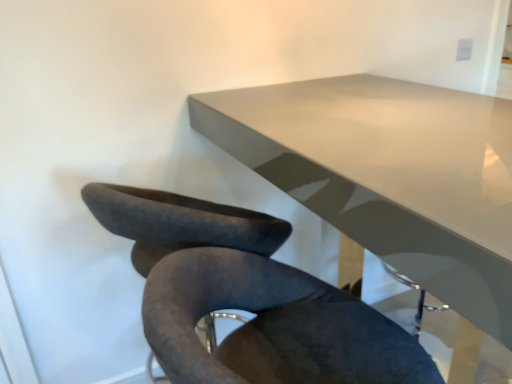
Question: From the image's perspective, is velvet dark gray chair at lower center above or below white glossy table at upper center?

Choices:
 (A) above
 (B) below

Answer: (B)

Question: Considering their positions, is velvet dark gray chair at lower center located in front of or behind white glossy table at upper center?

Choices:
 (A) front
 (B) behind

Answer: (A)

Question: Based on their sizes in the image, would you say velvet dark gray chair at lower center is bigger or smaller than white glossy table at upper center?

Choices:
 (A) small
 (B) big

Answer: (A)

Question: From a real-world perspective, is white glossy table at upper center physically located above or below velvet dark gray chair at lower center?

Choices:
 (A) below
 (B) above

Answer: (A)

Question: From the image's perspective, is white glossy table at upper center above or below velvet dark gray chair at lower center?

Choices:
 (A) below
 (B) above

Answer: (B)

Question: Would you say white glossy table at upper center is to the left or to the right of velvet dark gray chair at lower center in the picture?

Choices:
 (A) left
 (B) right

Answer: (B)

Question: Does point [223, 124] appear closer or farther from the camera than point [115, 205]?

Choices:
 (A) farther
 (B) closer

Answer: (A)